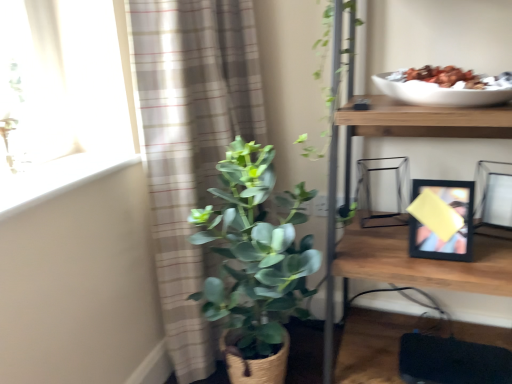
Question: Is plaid fabric curtain at left surrounding white smooth window sill at upper left?

Choices:
 (A) yes
 (B) no

Answer: (B)

Question: Can you confirm if plaid fabric curtain at left is bigger than white smooth window sill at upper left?

Choices:
 (A) yes
 (B) no

Answer: (A)

Question: Can you confirm if plaid fabric curtain at left is thinner than white smooth window sill at upper left?

Choices:
 (A) yes
 (B) no

Answer: (B)

Question: Is plaid fabric curtain at left far from white smooth window sill at upper left?

Choices:
 (A) yes
 (B) no

Answer: (B)

Question: From a real-world perspective, is plaid fabric curtain at left on white smooth window sill at upper left?

Choices:
 (A) yes
 (B) no

Answer: (B)

Question: Do you think green matte plant at center is within black matte picture frame at right, which is the second picture frame from right to left, or outside of it?

Choices:
 (A) outside
 (B) inside

Answer: (A)

Question: In the image, is green matte plant at center positioned in front of or behind black matte picture frame at right, which is the second picture frame from right to left?

Choices:
 (A) front
 (B) behind

Answer: (A)

Question: In terms of width, does green matte plant at center look wider or thinner when compared to black matte picture frame at right, which is the second picture frame from right to left?

Choices:
 (A) thin
 (B) wide

Answer: (B)

Question: Is green matte plant at center to the left or to the right of black matte picture frame at right, which is the second picture frame from right to left, in the image?

Choices:
 (A) left
 (B) right

Answer: (A)

Question: Based on their positions, is white smooth window sill at upper left located to the left or right of green matte plant at center?

Choices:
 (A) left
 (B) right

Answer: (A)

Question: Is white smooth window sill at upper left situated inside green matte plant at center or outside?

Choices:
 (A) outside
 (B) inside

Answer: (A)

Question: Is white smooth window sill at upper left bigger or smaller than green matte plant at center?

Choices:
 (A) big
 (B) small

Answer: (B)

Question: Is point (71, 172) positioned closer to the camera than point (257, 264)?

Choices:
 (A) closer
 (B) farther

Answer: (B)

Question: Would you say white smooth window sill at upper left is to the left or to the right of wooden shelf at upper right in the picture?

Choices:
 (A) right
 (B) left

Answer: (B)

Question: Relative to wooden shelf at upper right, is white smooth window sill at upper left in front or behind?

Choices:
 (A) front
 (B) behind

Answer: (B)